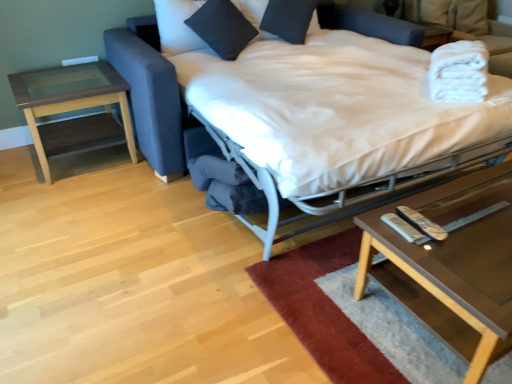
At what (x,y) coordinates should I click in order to perform the action: click on white plastic remote at lower right, the first remote viewed from the left. Please return your answer as a coordinate pair (x, y). The height and width of the screenshot is (384, 512). Looking at the image, I should click on (402, 227).

Measure the distance between point (59, 75) and camera.

A distance of 2.70 meters exists between point (59, 75) and camera.

What do you see at coordinates (73, 104) in the screenshot?
I see `brown wood/glass side table at left` at bounding box center [73, 104].

Image resolution: width=512 pixels, height=384 pixels. What are the coordinates of `white plastic remote at lower right, marked as the 1th remote in a right-to-left arrangement` in the screenshot? It's located at (421, 223).

Based on the photo, in order to face white soft towels at upper right, should I rotate leftwards or rightwards?

Rotate your view right by about 25.601°.

You are a GUI agent. You are given a task and a screenshot of the screen. Output one action in this format:
    pyautogui.click(x=<x>, y=<y>)
    Task: Click on the white soft towels at upper right
    
    Given the screenshot: What is the action you would take?
    459,72

This screenshot has height=384, width=512. I want to click on white fabric bed at center, so click(x=302, y=111).

Could you tell me if clear glass coffee table at lower right is turned towards black cotton pillow at upper center, arranged as the first pillow when viewed from the left?

No, clear glass coffee table at lower right does not turn towards black cotton pillow at upper center, arranged as the first pillow when viewed from the left.

Is clear glass coffee table at lower right positioned far away from black cotton pillow at upper center, which is counted as the second pillow, starting from the right?

That's right, there is a large distance between clear glass coffee table at lower right and black cotton pillow at upper center, which is counted as the second pillow, starting from the right.

How different are the orientations of clear glass coffee table at lower right and black cotton pillow at upper center, arranged as the first pillow when viewed from the left, in degrees?

The facing directions of clear glass coffee table at lower right and black cotton pillow at upper center, arranged as the first pillow when viewed from the left, are 5.22 degrees apart.

From a real-world perspective, is clear glass coffee table at lower right physically above black cotton pillow at upper center, arranged as the first pillow when viewed from the left?

No.

Is white fabric bed at center further to camera compared to brown wood/glass side table at left?

No, it is not.

Does white fabric bed at center turn towards brown wood/glass side table at left?

No, white fabric bed at center is not turned towards brown wood/glass side table at left.

Based on the photo, would you say white fabric bed at center is a long distance from brown wood/glass side table at left?

white fabric bed at center is actually quite close to brown wood/glass side table at left.

Is clear glass coffee table at lower right inside the boundaries of white plastic remote at lower right, the second remote viewed from the right, or outside?

clear glass coffee table at lower right cannot be found inside white plastic remote at lower right, the second remote viewed from the right.

Which point is more distant from viewer, (x=447, y=195) or (x=407, y=234)?

The point (x=447, y=195) is behind.

From a real-world perspective, which is physically above, clear glass coffee table at lower right or white plastic remote at lower right, the first remote viewed from the left?

In real-world perspective, white plastic remote at lower right, the first remote viewed from the left, is above.

Considering the sizes of objects clear glass coffee table at lower right and white fabric bed at center in the image provided, who is shorter, clear glass coffee table at lower right or white fabric bed at center?

Standing shorter between the two is clear glass coffee table at lower right.

From the image's perspective, would you say clear glass coffee table at lower right is positioned over white fabric bed at center?

No.

Is clear glass coffee table at lower right oriented away from white fabric bed at center?

Yes, clear glass coffee table at lower right is positioned with its back facing white fabric bed at center.

From a real-world perspective, who is located higher, clear glass coffee table at lower right or white fabric bed at center?

In real-world perspective, white fabric bed at center is above.

Is brown wood/glass side table at left bigger or smaller than soft wool rug at lower center?

In the image, brown wood/glass side table at left appears to be larger than soft wool rug at lower center.

From the image's perspective, which one is positioned lower, brown wood/glass side table at left or soft wool rug at lower center?

soft wool rug at lower center, from the image's perspective.

Who is more distant, brown wood/glass side table at left or soft wool rug at lower center?

Positioned behind is brown wood/glass side table at left.

From the picture: From a real-world perspective, between black cotton pillow at upper center, which is counted as the second pillow, starting from the right, and soft wool rug at lower center, who is vertically lower?

In real-world perspective, soft wool rug at lower center is lower.

Which object is wider, black cotton pillow at upper center, which is counted as the second pillow, starting from the right, or soft wool rug at lower center?

With larger width is soft wool rug at lower center.

From the image's perspective, which one is positioned higher, black cotton pillow at upper center, arranged as the first pillow when viewed from the left, or soft wool rug at lower center?

black cotton pillow at upper center, arranged as the first pillow when viewed from the left, appears higher in the image.

You are a GUI agent. You are given a task and a screenshot of the screen. Output one action in this format:
    pyautogui.click(x=<x>, y=<y>)
    Task: Click on the pillow that is the 1st object located above the soft wool rug at lower center (from the image's perspective)
    The width and height of the screenshot is (512, 384).
    Given the screenshot: What is the action you would take?
    pyautogui.click(x=222, y=28)

Is soft wool rug at lower center to the right of white plastic remote at lower right, the 2th remote in the left-to-right sequence, from the viewer's perspective?

Yes.

Are soft wool rug at lower center and white plastic remote at lower right, the 2th remote in the left-to-right sequence, far apart?

No, soft wool rug at lower center is in close proximity to white plastic remote at lower right, the 2th remote in the left-to-right sequence.

Is the position of soft wool rug at lower center more distant than that of white plastic remote at lower right, marked as the 1th remote in a right-to-left arrangement?

No.

The width and height of the screenshot is (512, 384). I want to click on coffee table below the black cotton pillow at upper center, arranged as the first pillow when viewed from the left (from a real-world perspective), so click(x=449, y=282).

Find the location of a particular element. The image size is (512, 384). bed above the brown wood/glass side table at left (from a real-world perspective) is located at coordinates (302, 111).

Which object lies nearer to the anchor point white fabric bed at center, black matte pillow at upper center, which is counted as the 2th pillow, starting from the left, or soft wool rug at lower center?

soft wool rug at lower center is closer to white fabric bed at center.

Considering their positions, is white plastic remote at lower right, the first remote viewed from the left, positioned closer to white soft towels at upper right than black matte pillow at upper center, acting as the first pillow starting from the right?

white plastic remote at lower right, the first remote viewed from the left.

Estimate the real-world distances between objects in this image. Which object is closer to black matte pillow at upper center, acting as the first pillow starting from the right, white plastic remote at lower right, the second remote viewed from the right, or white soft towels at upper right?

The object closer to black matte pillow at upper center, acting as the first pillow starting from the right, is white soft towels at upper right.

Considering their positions, is black cotton pillow at upper center, which is counted as the second pillow, starting from the right, positioned closer to clear glass coffee table at lower right than brown wood/glass side table at left?

black cotton pillow at upper center, which is counted as the second pillow, starting from the right, lies closer to clear glass coffee table at lower right than the other object.

When comparing their distances from white fabric bed at center, does brown wood/glass side table at left or black matte pillow at upper center, which is counted as the 2th pillow, starting from the left, seem further?

brown wood/glass side table at left.

Looking at the image, which one is located further to black cotton pillow at upper center, arranged as the first pillow when viewed from the left, clear glass coffee table at lower right or soft wool rug at lower center?

clear glass coffee table at lower right is further to black cotton pillow at upper center, arranged as the first pillow when viewed from the left.

Estimate the real-world distances between objects in this image. Which object is closer to white plastic remote at lower right, the 2th remote in the left-to-right sequence, white fabric bed at center or black matte pillow at upper center, acting as the first pillow starting from the right?

The object closer to white plastic remote at lower right, the 2th remote in the left-to-right sequence, is white fabric bed at center.

Which object lies further to the anchor point white soft towels at upper right, brown wood/glass side table at left or soft wool rug at lower center?

brown wood/glass side table at left lies further to white soft towels at upper right than the other object.

You are a GUI agent. You are given a task and a screenshot of the screen. Output one action in this format:
    pyautogui.click(x=<x>, y=<y>)
    Task: Click on the coffee table between white soft towels at upper right and soft wool rug at lower center vertically
    Image resolution: width=512 pixels, height=384 pixels.
    Given the screenshot: What is the action you would take?
    pyautogui.click(x=449, y=282)

The height and width of the screenshot is (384, 512). I want to click on remote between white fabric bed at center and white plastic remote at lower right, the second remote viewed from the right, from top to bottom, so click(x=421, y=223).

You are a GUI agent. You are given a task and a screenshot of the screen. Output one action in this format:
    pyautogui.click(x=<x>, y=<y>)
    Task: Click on the mat between brown wood/glass side table at left and white soft towels at upper right
    This screenshot has height=384, width=512.
    Given the screenshot: What is the action you would take?
    pyautogui.click(x=322, y=308)

Locate an element on the screen. Image resolution: width=512 pixels, height=384 pixels. mat located between white plastic remote at lower right, the second remote viewed from the right, and clear glass coffee table at lower right in the left-right direction is located at coordinates (322, 308).